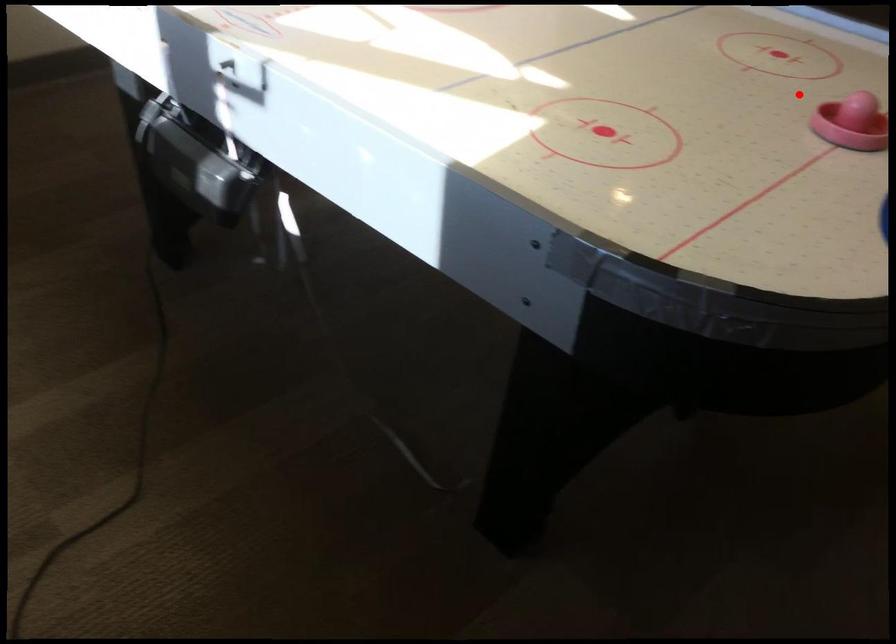
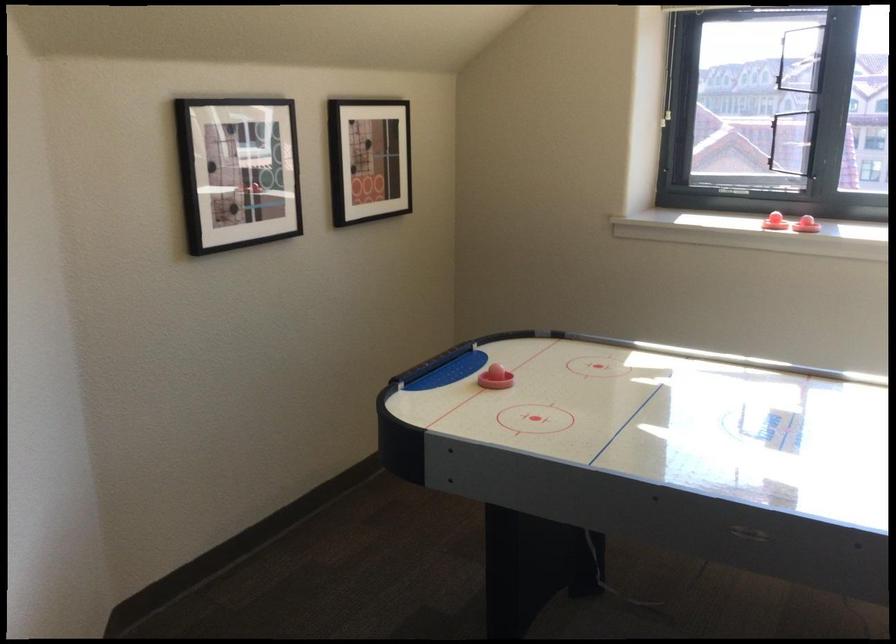
The point at the highlighted location is marked in the first image. Where is the corresponding point in the second image?

(495, 379)